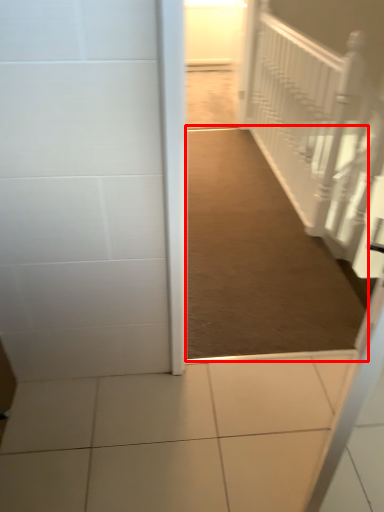
Question: From the image's perspective, what is the correct spatial relationship of path (annotated by the red box) in relation to stairwell?

Choices:
 (A) below
 (B) above

Answer: (A)